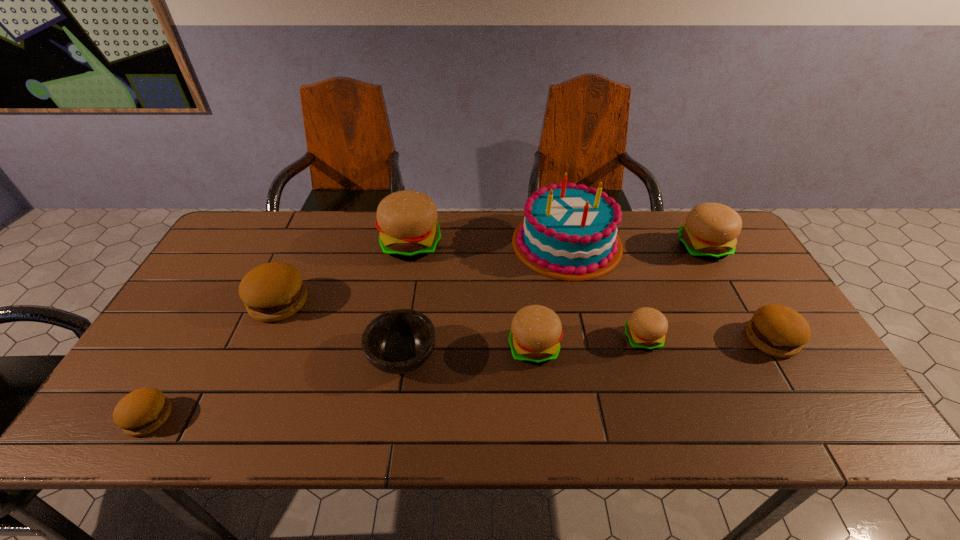
This screenshot has width=960, height=540. In order to click on free space between the second hamburger from left to right and the leftmost object in this screenshot , I will do 214,360.

Locate an element on the screen. free spot between the brown bowl and the eighth shortest object is located at coordinates (407, 301).

In order to click on vacant point located between the rightmost beige hamburger and the birthday cake in this screenshot , I will do `click(635, 246)`.

You are a GUI agent. You are given a task and a screenshot of the screen. Output one action in this format:
    pyautogui.click(x=<x>, y=<y>)
    Task: Click on the free space between the blue birthday cake and the second smallest beige hamburger
    The width and height of the screenshot is (960, 540).
    Given the screenshot: What is the action you would take?
    pyautogui.click(x=550, y=295)

This screenshot has width=960, height=540. Identify the location of object that stands as the seventh closest to the second brown hamburger from right to left. (710, 231).

The height and width of the screenshot is (540, 960). I want to click on object identified as the fifth closest to the second smallest brown hamburger, so point(399,341).

Find the location of a particular element. hamburger identified as the fourth closest to the smallest beige hamburger is located at coordinates (407, 220).

Identify which hamburger is the third nearest to the third beige hamburger from left to right. Please provide its 2D coordinates. Your answer should be formatted as a tuple, i.e. [(x, y)], where the tuple contains the x and y coordinates of a point satisfying the conditions above.

[(710, 231)]

At what (x,y) coordinates should I click in order to perform the action: click on beige hamburger that is the third closest to the second smallest beige hamburger. Please return your answer as a coordinate pair (x, y). Looking at the image, I should click on (710, 231).

At what (x,y) coordinates should I click in order to perform the action: click on the fourth closest beige hamburger to the nearest object. Please return your answer as a coordinate pair (x, y). The width and height of the screenshot is (960, 540). Looking at the image, I should click on (710, 231).